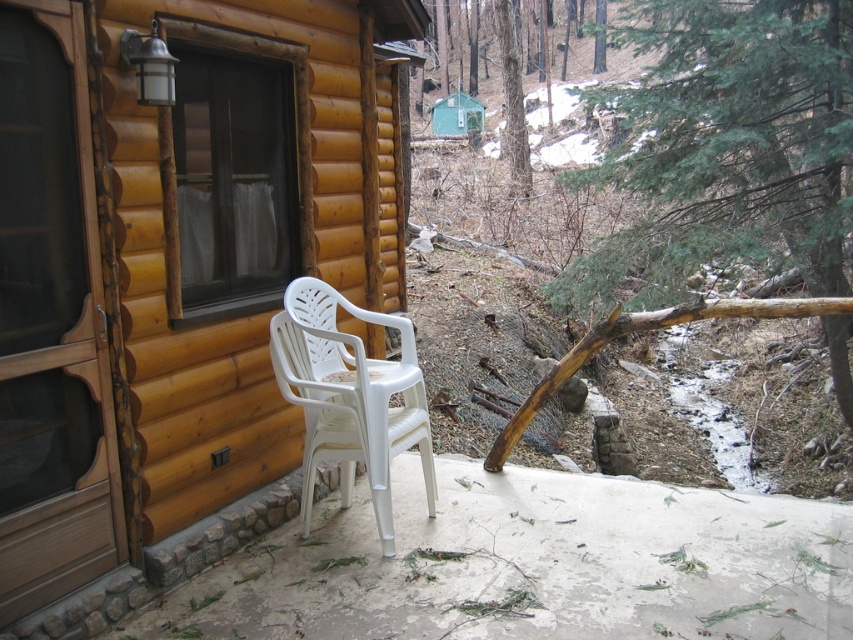
Question: Does matte plastic chair at lower right appear on the left side of white plastic chair at lower center?

Choices:
 (A) yes
 (B) no

Answer: (A)

Question: Does matte plastic chair at lower right appear over white plastic chair at lower center?

Choices:
 (A) no
 (B) yes

Answer: (B)

Question: Can you confirm if matte plastic chair at lower right is smaller than white plastic chair at lower center?

Choices:
 (A) no
 (B) yes

Answer: (A)

Question: Among these points, which one is farthest from the camera?

Choices:
 (A) (198, 541)
 (B) (372, 394)

Answer: (B)